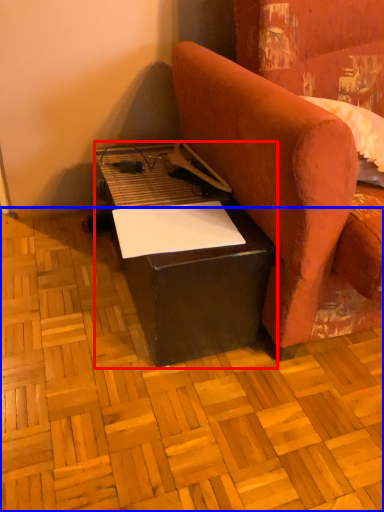
Question: Which point is closer to the camera, table (highlighted by a red box) or plywood (highlighted by a blue box)?

Choices:
 (A) table
 (B) plywood

Answer: (B)